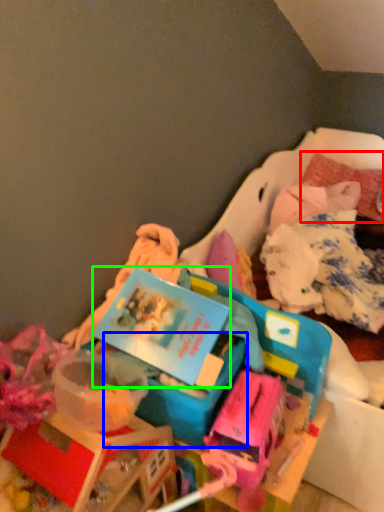
Question: Estimate the real-world distances between objects in this image. Which object is closer to pillow (highlighted by a red box), storage box (highlighted by a blue box) or kit (highlighted by a green box)?

Choices:
 (A) storage box
 (B) kit

Answer: (B)